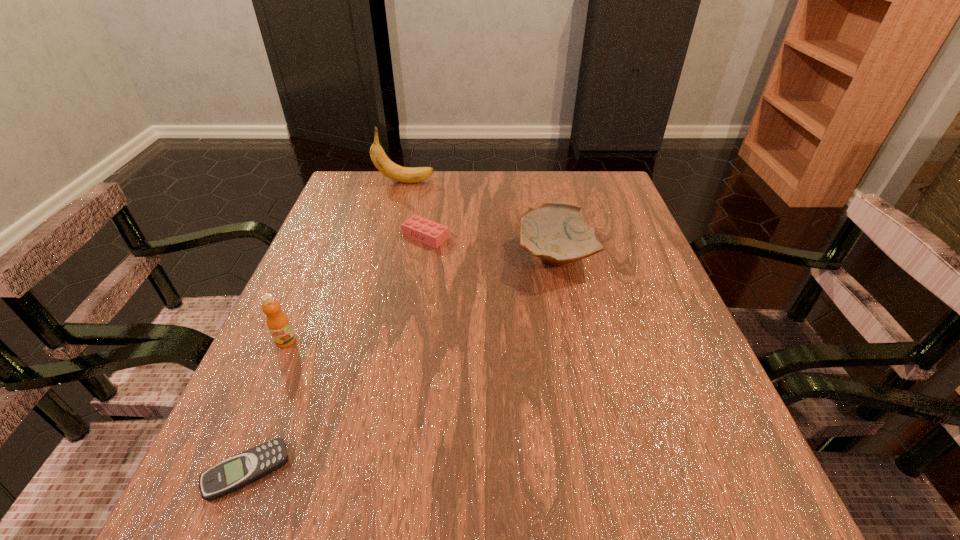
This screenshot has height=540, width=960. In order to click on free space located on the front label of the orange juice in this screenshot , I will do `click(218, 496)`.

Locate an element on the screen. Image resolution: width=960 pixels, height=540 pixels. vacant region located on the left of the rightmost object is located at coordinates (423, 256).

This screenshot has width=960, height=540. I want to click on vacant space situated on the left of the second shortest object, so click(344, 237).

This screenshot has width=960, height=540. In order to click on vacant space situated on the back of the shortest object in this screenshot , I will do `click(306, 325)`.

Where is `object that is positioned at the far edge`? The image size is (960, 540). object that is positioned at the far edge is located at coordinates coord(388,168).

The height and width of the screenshot is (540, 960). Identify the location of object that is at the near edge. (242, 469).

Where is `banana that is positioned at the left edge`? Image resolution: width=960 pixels, height=540 pixels. banana that is positioned at the left edge is located at coordinates (388, 168).

Find the location of a particular element. The height and width of the screenshot is (540, 960). orange juice present at the left edge is located at coordinates (278, 324).

The image size is (960, 540). What are the coordinates of `beeper that is positioned at the left edge` in the screenshot? It's located at (242, 469).

I want to click on object present at the right edge, so click(555, 232).